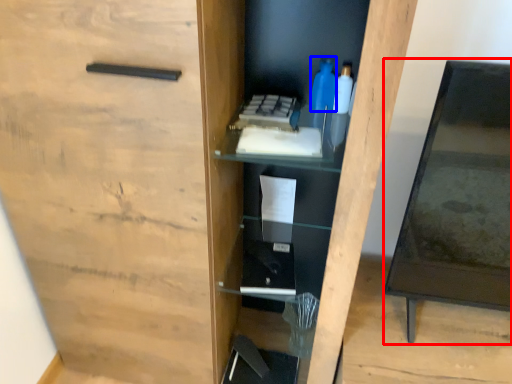
Question: Among these objects, which one is farthest to the camera, table (highlighted by a red box) or bottle (highlighted by a blue box)?

Choices:
 (A) table
 (B) bottle

Answer: (B)